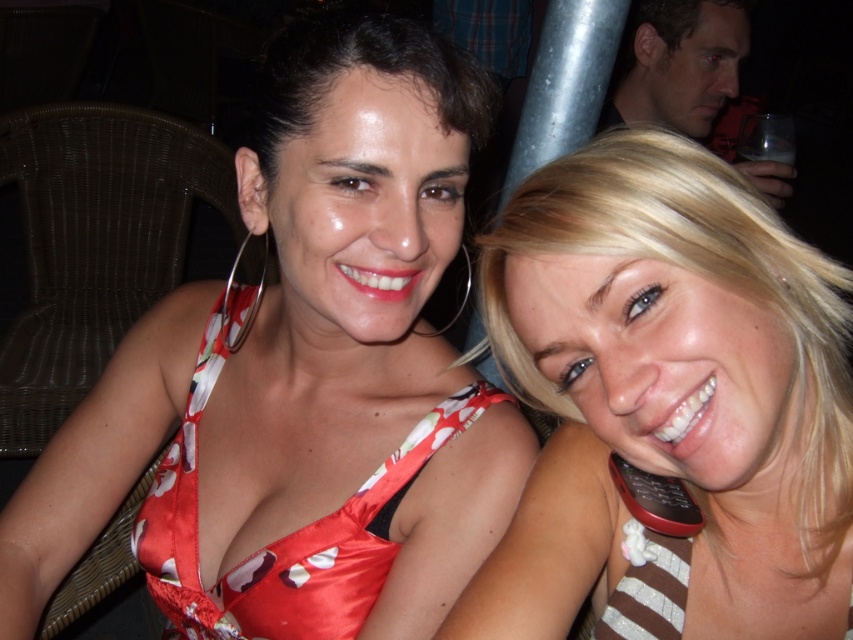
Can you confirm if satin floral bikini top at center is taller than smooth glass at upper right?

Incorrect, satin floral bikini top at center's height is not larger of smooth glass at upper right's.

You are a GUI agent. You are given a task and a screenshot of the screen. Output one action in this format:
    pyautogui.click(x=<x>, y=<y>)
    Task: Click on the satin floral bikini top at center
    The width and height of the screenshot is (853, 640).
    Given the screenshot: What is the action you would take?
    pyautogui.click(x=283, y=536)

Does point (152, 528) lie behind point (697, 38)?

No.

In order to click on satin floral bikini top at center in this screenshot , I will do `click(283, 536)`.

Describe the element at coordinates (302, 376) in the screenshot. I see `floral satin dress at center` at that location.

Can you confirm if floral satin dress at center is taller than smooth glass at upper right?

Yes.

Who is more forward, (410,371) or (682,29)?

Point (410,371) is more forward.

At what (x,y) coordinates should I click in order to perform the action: click on floral satin dress at center. Please return your answer as a coordinate pair (x, y). The image size is (853, 640). Looking at the image, I should click on (302, 376).

You are a GUI agent. You are given a task and a screenshot of the screen. Output one action in this format:
    pyautogui.click(x=<x>, y=<y>)
    Task: Click on the floral satin dress at center
    This screenshot has height=640, width=853.
    Given the screenshot: What is the action you would take?
    pyautogui.click(x=302, y=376)

Between floral satin dress at center and satin floral bikini top at center, which one is positioned higher?

floral satin dress at center is higher up.

Image resolution: width=853 pixels, height=640 pixels. Identify the location of floral satin dress at center. (302, 376).